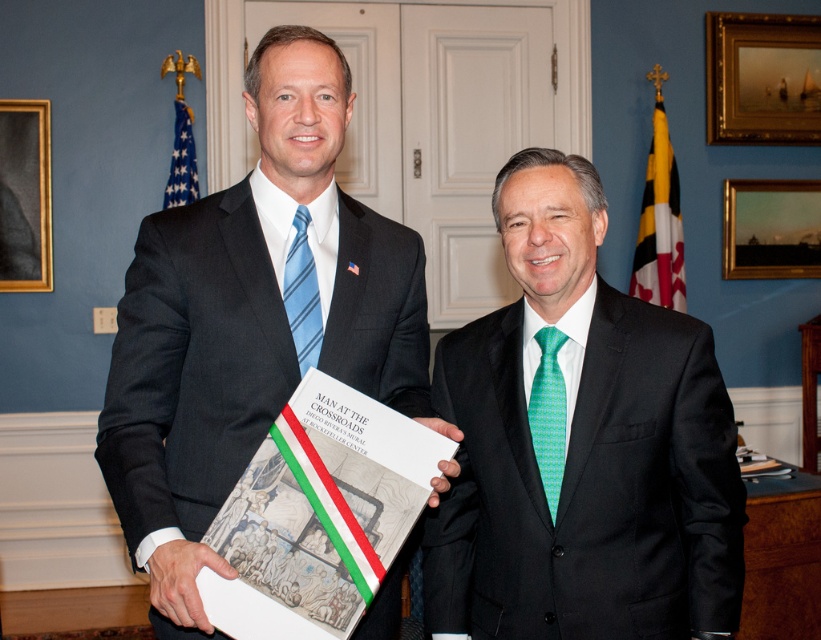
You are an interior designer assessing the space for a new piece of furniture. You notice the black suit at center and the gold wooden picture frame at upper right. Which object would require a larger space to accommodate?

The black suit at center requires a larger space because it is bigger than the gold wooden picture frame at upper right.

You are a photographer standing at a certain distance from the green textured tie at center. You need to capture a closeup shot of the tie, but your camera requires the subject to be within 1.2 meters. Can you take the photo without moving closer?

The distance between the green textured tie at center and the camera is 1.44 meters, which is beyond the camera requirement of 1.2 meters. Therefore, you need to move closer to take the closeup shot.